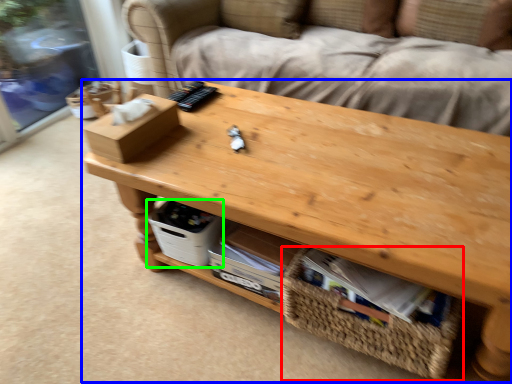
Question: Estimate the real-world distances between objects in this image. Which object is farther from basket (highlighted by a red box), table (highlighted by a blue box) or storage box (highlighted by a green box)?

Choices:
 (A) table
 (B) storage box

Answer: (B)